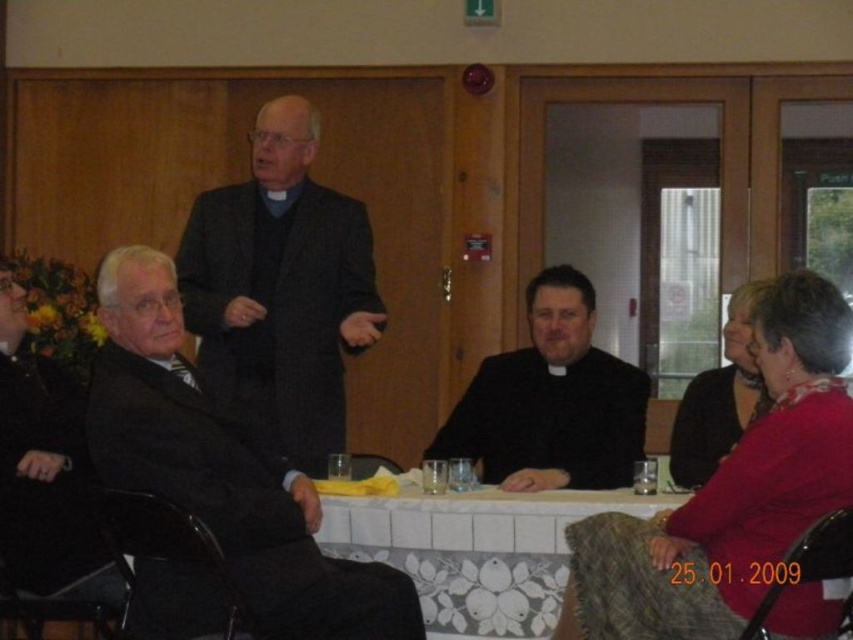
You are standing in the room and want to move from point A to point B. Point A is at coordinate point (567, 636) and point B is at coordinate point (498, 440). Which point is closer to you?

Point (567, 636) is closer to the camera than point (498, 440), so you are closer to point (567, 636).

You are organizing a charity event and need to ensure that the seating arrangement allows for easy access to the emergency exit. The emergency exit is located near the door with the red alarm light. Considering the seating arrangement, which object is closer to the emergency exit, the matte pink sweater at lower right or the black matte suit at center?

The matte pink sweater at lower right is closer to the emergency exit because it is positioned at the lower right, which is near the door with the red emergency alarm light, while the black matte suit at center is located further away from the exit.

Based on the photo, you are standing at the entrance of the room and want to locate the matte pink sweater at lower right. According to the coordinates provided, where should you look relative to the door?

The matte pink sweater at lower right is located at coordinates point (730, 492), which is towards the lower right area of the image. Since the door is near the wall where the fire extinguisher is placed, you should look towards the lower right direction from the door to find the sweater.